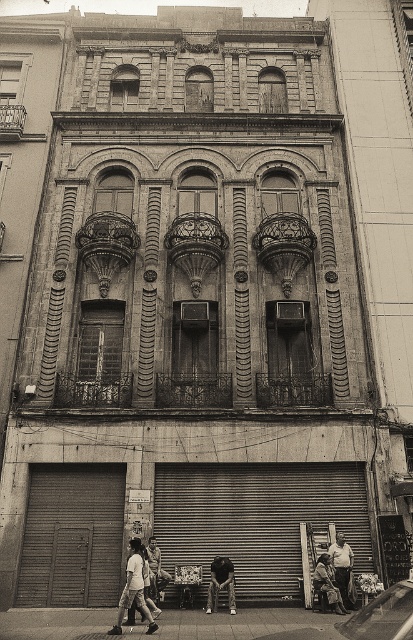
You are standing in front of the building and notice a white cotton shirt at lower center and a wooden stool at lower center. Which object is closer to the left side of the building?

The white cotton shirt at lower center is closer to the left side of the building because it is positioned to the left of the wooden stool at lower center.

You are a security guard in a museum and need to locate the light brown leather jacket at lower center. According to the image, where is the point at coordinate (341,564) located on the light brown leather jacket at lower center?

The point at coordinate (341,564) is located on the light brown leather jacket at lower center.

You are a delivery person trying to place a package between the light brown leather jacket at lower center and the wooden stool at lower center. Can you fit the package there if it is 1 meter wide?

The light brown leather jacket at lower center might be wider than the wooden stool at lower center, so the space between them may not be wide enough for a 1 meter wide package. Check the actual width before placing the package.